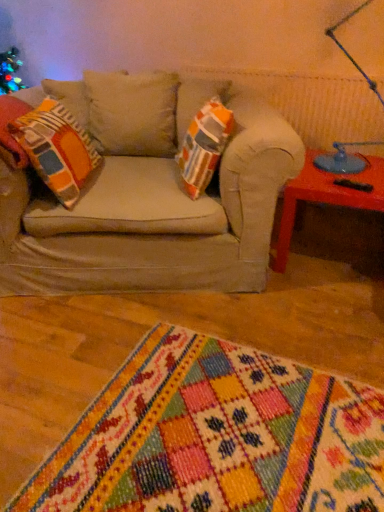
The image size is (384, 512). What are the coordinates of `free region under blue glass table lamp at upper right (from a real-world perspective)` in the screenshot? It's located at (346, 170).